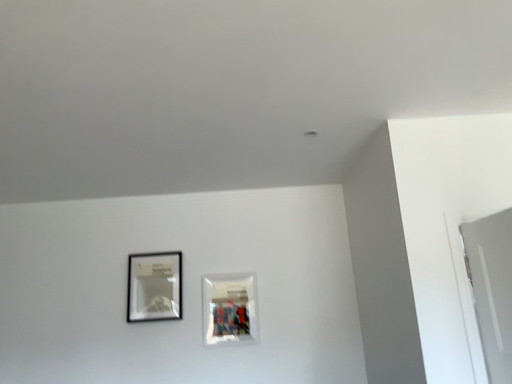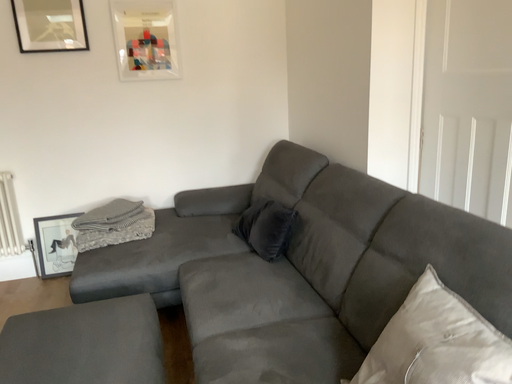
Question: How did the camera likely rotate when shooting the video?

Choices:
 (A) rotated upward
 (B) rotated downward

Answer: (B)